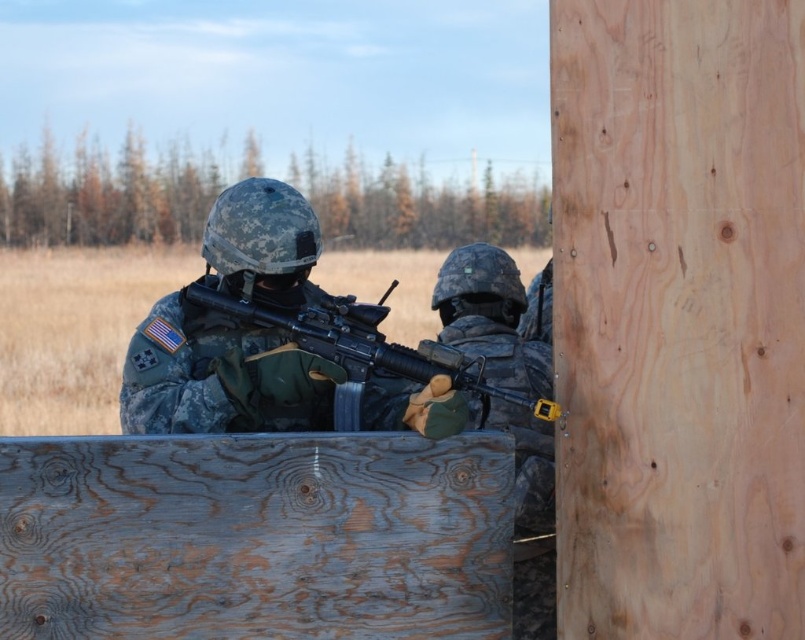
Can you confirm if camouflage fabric rifle at center is positioned to the right of matte black rifle at center?

In fact, camouflage fabric rifle at center is to the left of matte black rifle at center.

Which is behind, point (131, 356) or point (345, 296)?

The point (131, 356) is more distant.

Identify the location of camouflage fabric rifle at center. (219, 378).

Locate an element on the screen. Image resolution: width=805 pixels, height=640 pixels. camouflage fabric rifle at center is located at coordinates tap(219, 378).